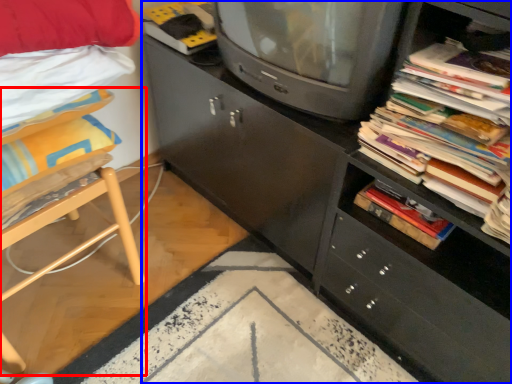
Question: Which point is closer to the camera, furniture (highlighted by a red box) or cabinetry (highlighted by a blue box)?

Choices:
 (A) furniture
 (B) cabinetry

Answer: (B)